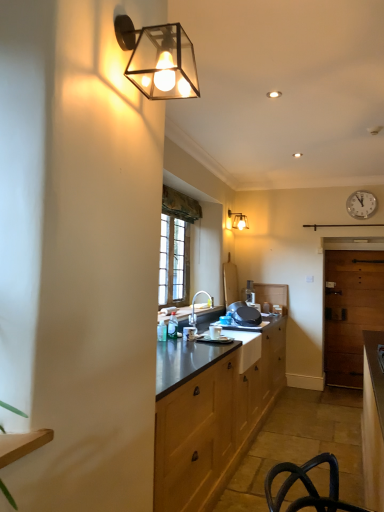
Question: Does matte silver faucet at center have a lesser width compared to matte black wall sconce at upper left, the second lamp positioned from the back?

Choices:
 (A) yes
 (B) no

Answer: (B)

Question: Would you say matte black wall sconce at upper left, marked as the first lamp in a front-to-back arrangement, is part of matte silver faucet at center's contents?

Choices:
 (A) yes
 (B) no

Answer: (B)

Question: Could you tell me if matte silver faucet at center is turned towards matte black wall sconce at upper left, the second lamp positioned from the back?

Choices:
 (A) no
 (B) yes

Answer: (A)

Question: Does matte silver faucet at center have a lesser height compared to matte black wall sconce at upper left, which is the 2th lamp from right to left?

Choices:
 (A) no
 (B) yes

Answer: (A)

Question: From a real-world perspective, is matte silver faucet at center positioned under matte black wall sconce at upper left, marked as the first lamp in a front-to-back arrangement, based on gravity?

Choices:
 (A) no
 (B) yes

Answer: (B)

Question: Is white plastic clock at upper right inside or outside of wooden door at right?

Choices:
 (A) inside
 (B) outside

Answer: (B)

Question: Is white plastic clock at upper right to the left or to the right of wooden door at right in the image?

Choices:
 (A) left
 (B) right

Answer: (A)

Question: From the image's perspective, is white plastic clock at upper right above or below wooden door at right?

Choices:
 (A) below
 (B) above

Answer: (B)

Question: Does point (355, 207) appear closer or farther from the camera than point (349, 273)?

Choices:
 (A) closer
 (B) farther

Answer: (A)

Question: From the image's perspective, is white plastic clock at upper right positioned above or below matte glass wall sconce at upper center, which is counted as the first lamp, starting from the right?

Choices:
 (A) above
 (B) below

Answer: (A)

Question: Considering the positions of white plastic clock at upper right and matte glass wall sconce at upper center, which is counted as the first lamp, starting from the right, in the image, is white plastic clock at upper right wider or thinner than matte glass wall sconce at upper center, which is counted as the first lamp, starting from the right,?

Choices:
 (A) wide
 (B) thin

Answer: (B)

Question: Considering the positions of point [374, 206] and point [238, 222], is point [374, 206] closer or farther from the camera than point [238, 222]?

Choices:
 (A) closer
 (B) farther

Answer: (A)

Question: Looking at the image, does white plastic clock at upper right seem bigger or smaller compared to matte glass wall sconce at upper center, the 2th lamp in the left-to-right sequence?

Choices:
 (A) small
 (B) big

Answer: (A)

Question: Is point (200, 289) closer or farther from the camera than point (375, 298)?

Choices:
 (A) farther
 (B) closer

Answer: (B)

Question: Is matte silver faucet at center inside the boundaries of wooden door at right, or outside?

Choices:
 (A) outside
 (B) inside

Answer: (A)